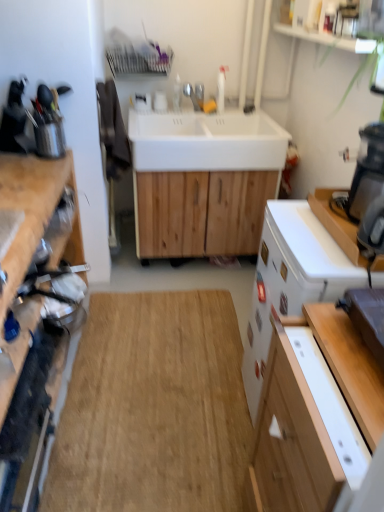
Identify the location of free point above natural wood table at center (from a real-world perspective). (166, 371).